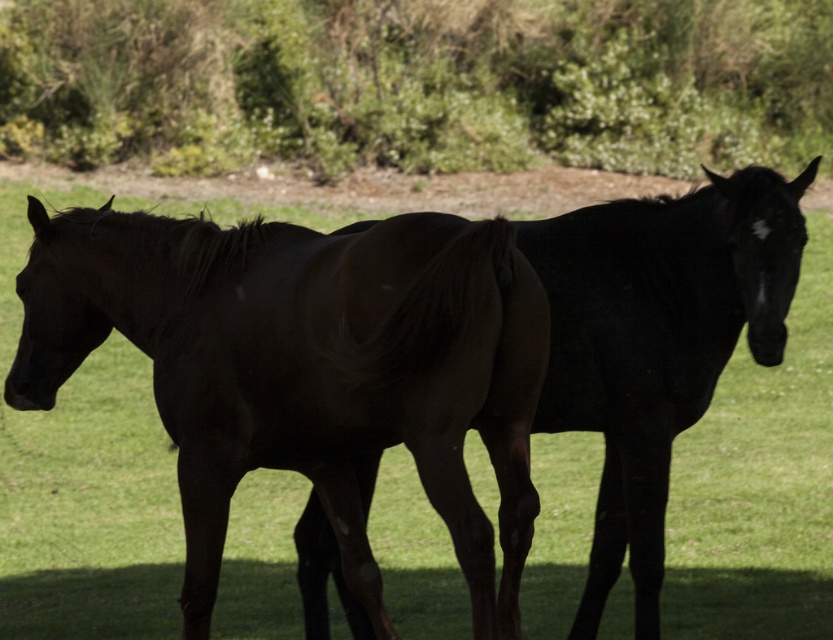
Does point (569, 99) lie behind point (313, 580)?

Yes, point (569, 99) is behind point (313, 580).

Does green leafy bush at upper center have a smaller size compared to shiny black horse at center?

Incorrect, green leafy bush at upper center is not smaller in size than shiny black horse at center.

Who is more distant from viewer, (606, 99) or (602, 252)?

The point (606, 99) is behind.

What are the coordinates of `green leafy bush at upper center` in the screenshot? It's located at click(x=417, y=83).

Does green leafy bush at upper center appear over shiny black horse at left?

Indeed, green leafy bush at upper center is positioned over shiny black horse at left.

Is green leafy bush at upper center bigger than shiny black horse at left?

Indeed, green leafy bush at upper center has a larger size compared to shiny black horse at left.

Who is more distant from viewer, (x=338, y=164) or (x=328, y=426)?

The point (x=338, y=164) is behind.

At what (x,y) coordinates should I click in order to perform the action: click on green leafy bush at upper center. Please return your answer as a coordinate pair (x, y). Looking at the image, I should click on (417, 83).

Who is lower down, shiny black horse at left or shiny black horse at center?

Positioned lower is shiny black horse at left.

Is point (509, 422) positioned behind point (347, 605)?

That is False.

Find the location of a particular element. This screenshot has height=640, width=833. shiny black horse at left is located at coordinates (307, 369).

Where is `shiny black horse at left`? shiny black horse at left is located at coordinates (307, 369).